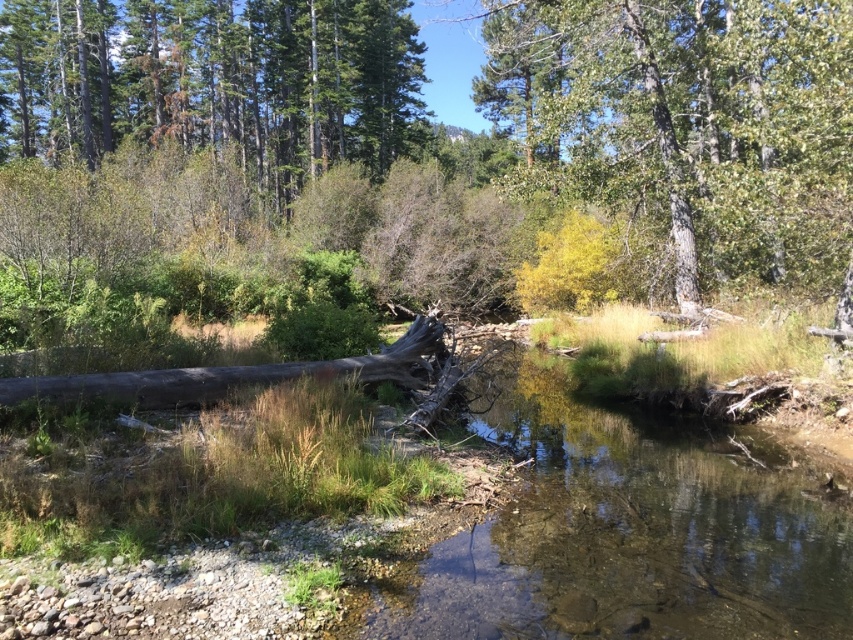
You are standing at the edge of the stream in the scene. Looking towards the green leafy tree at upper center, which direction would you face? Please provide your answer based on the coordinates provided in the Objects Description.

The green leafy tree at upper center is located at coordinates point (x=688, y=124), which means it is positioned slightly to the left and near the top of the image. Facing towards it from the stream edge would require turning your head upwards and to the left.

You are standing at the camera position and want to reach the point at coordinates point (722, 227). Is this point within a 15 meter walking distance?

The distance of point (722, 227) from camera is 13.20 meters, so yes, it is within 15 meters.

You are an observer standing in the forest looking at the scene. Which tree is positioned lower in the image, the green leafy tree at upper center or the green matte tree at upper left?

The green leafy tree at upper center is positioned lower than the green matte tree at upper left in the image.